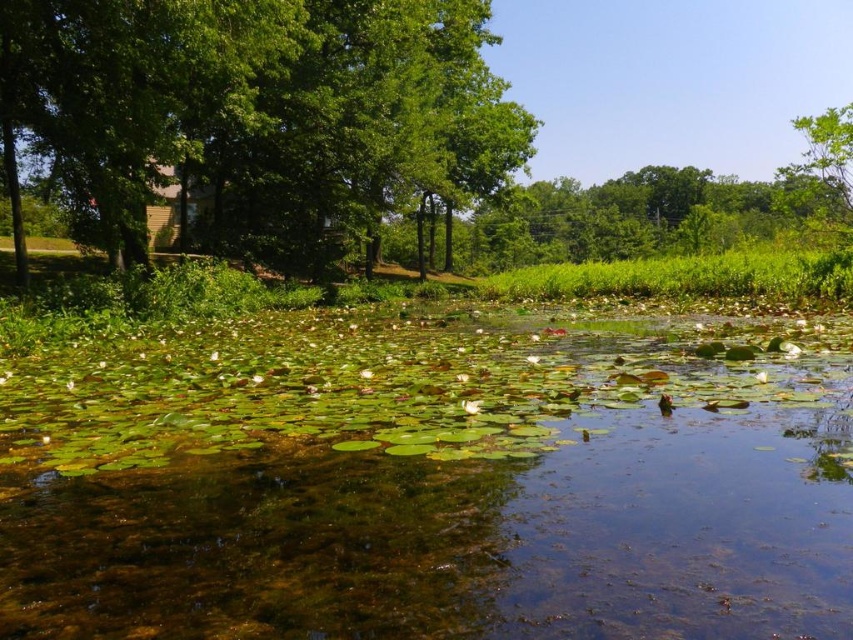
Can you confirm if green leafy tree at upper left is bigger than green leafy tree at upper right?

Actually, green leafy tree at upper left might be smaller than green leafy tree at upper right.

Between point (363, 109) and point (838, 118), which one is positioned behind?

Positioned behind is point (363, 109).

The height and width of the screenshot is (640, 853). Find the location of `green leafy tree at upper left`. green leafy tree at upper left is located at coordinates (256, 115).

The image size is (853, 640). I want to click on green leafy tree at upper left, so click(256, 115).

At what (x,y) coordinates should I click in order to perform the action: click on green leafy water at center. Please return your answer as a coordinate pair (x, y). The image size is (853, 640). Looking at the image, I should click on (428, 483).

Does green leafy water at center appear on the right side of green leafy tree at upper left?

Yes, green leafy water at center is to the right of green leafy tree at upper left.

Describe the element at coordinates (428, 483) in the screenshot. I see `green leafy water at center` at that location.

Where is `green leafy water at center`? The height and width of the screenshot is (640, 853). green leafy water at center is located at coordinates 428,483.

Which of these two, green leafy water at center or green leafy tree at upper right, stands shorter?

With less height is green leafy water at center.

Does green leafy water at center have a lesser height compared to green leafy tree at upper right?

Yes.

Is point (71, 486) farther from camera compared to point (828, 205)?

That is False.

I want to click on green leafy water at center, so click(x=428, y=483).